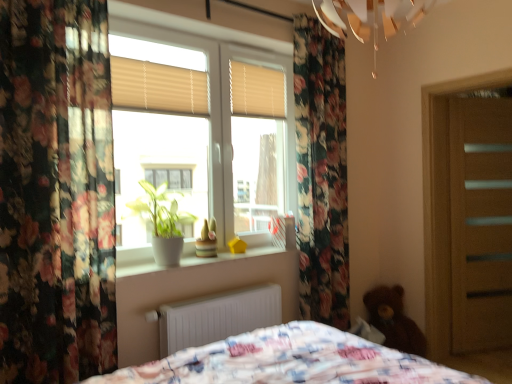
At what (x,y) coordinates should I click in order to perform the action: click on brown wooden screen door at right. Please return your answer as a coordinate pair (x, y). This screenshot has height=384, width=512. Looking at the image, I should click on pos(481,223).

The image size is (512, 384). What do you see at coordinates (481, 223) in the screenshot? I see `brown wooden screen door at right` at bounding box center [481, 223].

What do you see at coordinates (201, 133) in the screenshot? The image size is (512, 384). I see `white plastic window at center` at bounding box center [201, 133].

Locate an element on the screen. The width and height of the screenshot is (512, 384). brown plush teddy bear at lower right is located at coordinates (394, 320).

Considering the sizes of objects white plastic window at center and floral fabric curtain at left in the image provided, who is smaller, white plastic window at center or floral fabric curtain at left?

Smaller between the two is white plastic window at center.

Which object is further away from the camera taking this photo, white plastic window at center or floral fabric curtain at left?

white plastic window at center.

Does point (253, 176) appear closer or farther from the camera than point (23, 105)?

Point (253, 176) is positioned farther from the camera compared to point (23, 105).

Is beige/wooden blinds at upper center, the second shutter from the left, next to floral fabric curtain at left and touching it?

No, beige/wooden blinds at upper center, the second shutter from the left, is not in contact with floral fabric curtain at left.

From a real-world perspective, which shutter is the 2nd one above the floral fabric curtain at left? Please provide its 2D coordinates.

[(257, 90)]

Does beige/wooden blinds at upper center, the first shutter from the back, have a greater width compared to floral fabric curtain at left?

Incorrect, the width of beige/wooden blinds at upper center, the first shutter from the back, does not surpass that of floral fabric curtain at left.

Is point (259, 90) closer or farther from the camera than point (69, 267)?

Point (259, 90) appears to be farther away from the viewer than point (69, 267).

Can you tell me how much floral fabric curtain at left and white matte radiator at lower center differ in facing direction?

0.655 degrees.

Image resolution: width=512 pixels, height=384 pixels. Find the location of `curtain above the white matte radiator at lower center (from a real-world perspective)`. curtain above the white matte radiator at lower center (from a real-world perspective) is located at coordinates (56, 192).

Is floral fabric curtain at left placed right next to white matte radiator at lower center?

No, floral fabric curtain at left is not in contact with white matte radiator at lower center.

Does floral fabric curtain at left have a smaller size compared to white matte radiator at lower center?

Actually, floral fabric curtain at left might be larger than white matte radiator at lower center.

Is floral fabric curtain at left at the back of beige fabric blinds at upper center, acting as the first shutter starting from the front?

beige fabric blinds at upper center, acting as the first shutter starting from the front, is not turned away from floral fabric curtain at left.

Could you measure the distance between beige fabric blinds at upper center, acting as the first shutter starting from the front, and floral fabric curtain at left?

beige fabric blinds at upper center, acting as the first shutter starting from the front, is 26.79 inches from floral fabric curtain at left.

Which is more to the right, beige fabric blinds at upper center, placed as the second shutter when sorted from back to front, or floral fabric curtain at left?

beige fabric blinds at upper center, placed as the second shutter when sorted from back to front.

Can you confirm if beige fabric blinds at upper center, placed as the second shutter when sorted from back to front, is smaller than floral fabric curtain at left?

Correct, beige fabric blinds at upper center, placed as the second shutter when sorted from back to front, occupies less space than floral fabric curtain at left.

From a real-world perspective, is brown wooden screen door at right located higher than green matte plant at window?

No, from a real-world perspective, brown wooden screen door at right is not above green matte plant at window.

Does brown wooden screen door at right touch green matte plant at window?

No, brown wooden screen door at right is not in contact with green matte plant at window.

Considering the relative sizes of brown wooden screen door at right and green matte plant at window in the image provided, is brown wooden screen door at right taller than green matte plant at window?

Yes, brown wooden screen door at right is taller than green matte plant at window.

Is the surface of white matte radiator at lower center in direct contact with white plastic window at center?

No, white matte radiator at lower center is not with white plastic window at center.

Is white matte radiator at lower center oriented towards white plastic window at center?

No, white matte radiator at lower center is not facing towards white plastic window at center.

Find the location of `radiator directly beneath the white plastic window at center (from a real-world perspective)`. radiator directly beneath the white plastic window at center (from a real-world perspective) is located at coordinates (217, 317).

From a real-world perspective, is white matte radiator at lower center positioned over white plastic window at center based on gravity?

No, from a real-world perspective, white matte radiator at lower center is not on top of white plastic window at center.

Is floral fabric curtain at left shorter than beige fabric blinds at upper center, the second shutter from the right?

No.

Between floral fabric curtain at left and beige fabric blinds at upper center, the second shutter from the right, which one has smaller width?

beige fabric blinds at upper center, the second shutter from the right, is thinner.

Does point (74, 280) come closer to viewer compared to point (198, 104)?

Yes, point (74, 280) is closer to viewer.

From the image's perspective, is floral fabric curtain at left over beige fabric blinds at upper center, the 1th shutter positioned from the left?

Incorrect, from the image's perspective, floral fabric curtain at left is lower than beige fabric blinds at upper center, the 1th shutter positioned from the left.

I want to click on curtain located below the white plastic window at center (from the image's perspective), so click(56, 192).

There is a floral fabric curtain at left. At what (x,y) coordinates should I click in order to perform the action: click on the 2nd shutter above it (from a real-world perspective). Please return your answer as a coordinate pair (x, y). Image resolution: width=512 pixels, height=384 pixels. Looking at the image, I should click on (257, 90).

From the image, which object appears to be farther from white plastic window at center, beige/wooden blinds at upper center, arranged as the second shutter when viewed from the front, or green matte plant at window?

green matte plant at window lies further to white plastic window at center than the other object.

Based on the photo, looking at the image, which one is located further to white plastic window at center, green matte plant at window or white matte radiator at lower center?

white matte radiator at lower center lies further to white plastic window at center than the other object.

When comparing their distances from brown wooden screen door at right, does white plastic window at center or beige fabric blinds at upper center, the second shutter from the right, seem closer?

Based on the image, white plastic window at center appears to be nearer to brown wooden screen door at right.

When comparing their distances from floral fabric curtain at left, does green matte plant at window or white matte radiator at lower center seem closer?

Based on the image, green matte plant at window appears to be nearer to floral fabric curtain at left.

Looking at this image, when comparing their distances from beige fabric blinds at upper center, placed as the second shutter when sorted from back to front, does white matte radiator at lower center or green matte plant at window seem closer?

green matte plant at window is positioned closer to the anchor beige fabric blinds at upper center, placed as the second shutter when sorted from back to front.

When comparing their distances from beige fabric blinds at upper center, acting as the first shutter starting from the front, does brown plush teddy bear at lower right or brown wooden screen door at right seem further?

The object further to beige fabric blinds at upper center, acting as the first shutter starting from the front, is brown wooden screen door at right.

When comparing their distances from floral fabric curtain at left, does brown plush teddy bear at lower right or green matte plant at window seem further?

brown plush teddy bear at lower right is positioned further to the anchor floral fabric curtain at left.

Estimate the real-world distances between objects in this image. Which object is closer to brown wooden screen door at right, white plastic window at center or floral fabric curtain at left?

white plastic window at center is closer to brown wooden screen door at right.

Identify the location of curtain between beige fabric blinds at upper center, the 1th shutter positioned from the left, and white matte radiator at lower center from top to bottom. (56, 192).

Identify the location of radiator that lies between beige fabric blinds at upper center, the second shutter from the right, and brown plush teddy bear at lower right from top to bottom. (217, 317).

I want to click on window between beige/wooden blinds at upper center, arranged as the second shutter when viewed from the front, and white matte radiator at lower center in the up-down direction, so click(201, 133).

Where is `teddy between white matte radiator at lower center and brown wooden screen door at right in the horizontal direction`? This screenshot has height=384, width=512. teddy between white matte radiator at lower center and brown wooden screen door at right in the horizontal direction is located at coordinates (394, 320).